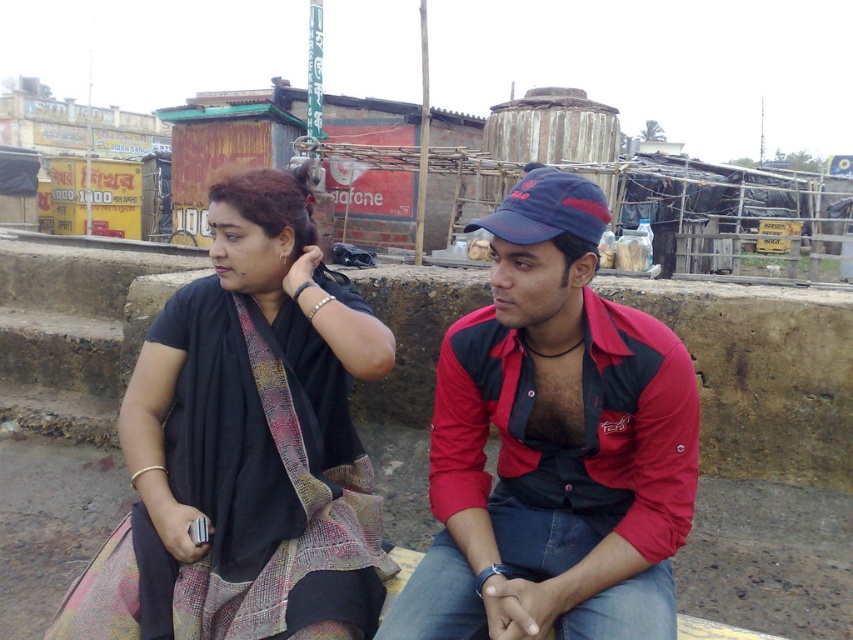
Who is more forward, (544, 624) or (152, 540)?

Positioned in front is point (544, 624).

Between red fabric shirt at center and black woven sari at left, which one has more height?

black woven sari at left is taller.

Is point (556, 188) behind point (199, 371)?

No, (556, 188) is in front of (199, 371).

I want to click on red fabric shirt at center, so click(554, 444).